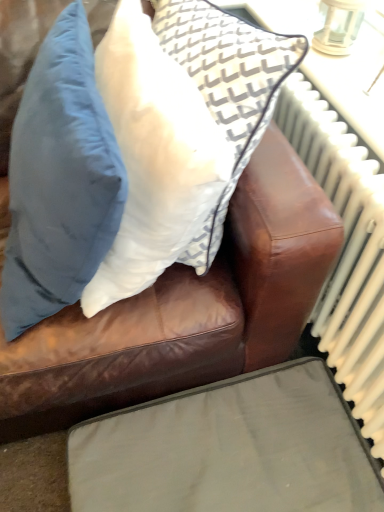
Image resolution: width=384 pixels, height=512 pixels. Identify the location of empty space that is ontop of matte gray cushion at lower center (from a real-world perspective). (234, 452).